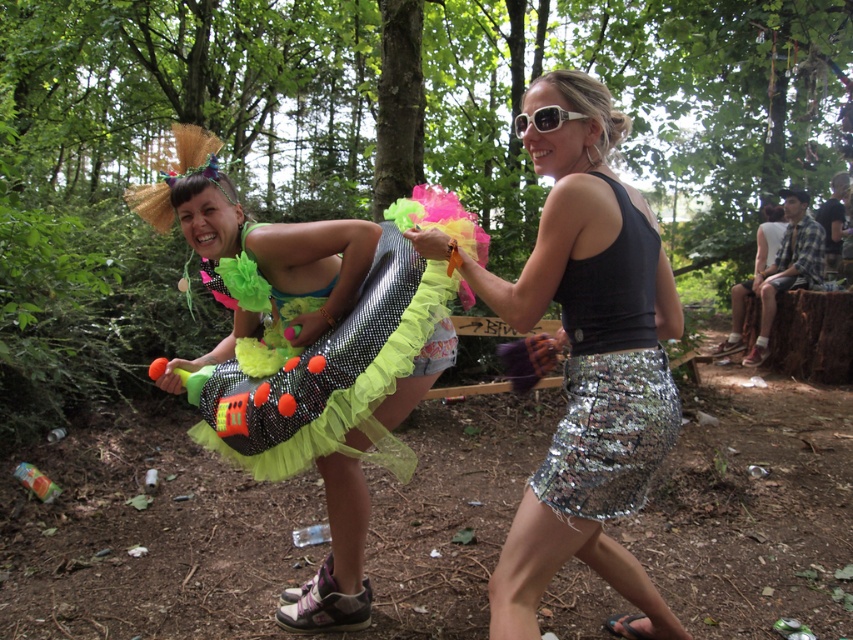
Question: Estimate the real-world distances between objects in this image. Which object is farther from the shiny sequin skirt at center?

Choices:
 (A) silver sequined skirt at center
 (B) shiny sequined dress at center

Answer: (B)

Question: Can you confirm if shiny sequin skirt at center is smaller than silver sequined skirt at center?

Choices:
 (A) no
 (B) yes

Answer: (A)

Question: Among these points, which one is nearest to the camera?

Choices:
 (A) (595, 513)
 (B) (355, 580)
 (C) (631, 493)

Answer: (A)

Question: Is shiny sequined dress at center wider than shiny sequin skirt at center?

Choices:
 (A) yes
 (B) no

Answer: (A)

Question: Does shiny sequined dress at center have a larger size compared to shiny sequin skirt at center?

Choices:
 (A) yes
 (B) no

Answer: (A)

Question: Which point is closer to the camera?

Choices:
 (A) glittery sequined dress at center
 (B) shiny sequin skirt at center
 (C) silver sequined skirt at center

Answer: (B)